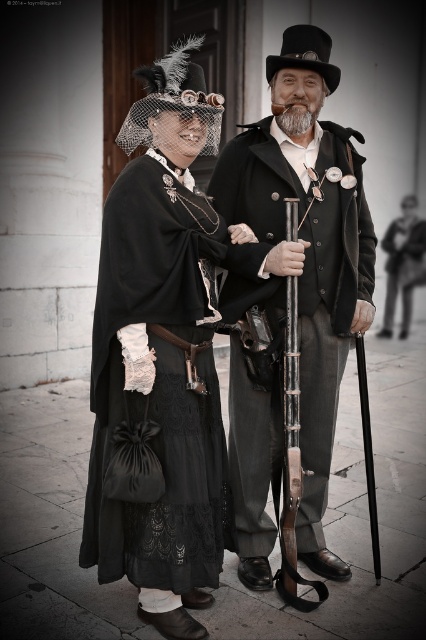
Is matte black coat at center below black lace dress at left?

No, matte black coat at center is not below black lace dress at left.

How distant is matte black coat at center from black lace dress at left?

matte black coat at center and black lace dress at left are 57.59 centimeters apart from each other.

You are a GUI agent. You are given a task and a screenshot of the screen. Output one action in this format:
    pyautogui.click(x=<x>, y=<y>)
    Task: Click on the matte black coat at center
    This screenshot has width=426, height=640.
    Given the screenshot: What is the action you would take?
    pyautogui.click(x=308, y=246)

This screenshot has height=640, width=426. I want to click on matte black coat at center, so click(x=308, y=246).